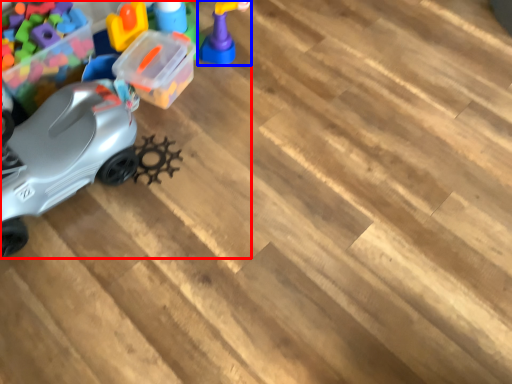
Question: Which object appears closest to the camera in this image, toy (highlighted by a red box) or toy (highlighted by a blue box)?

Choices:
 (A) toy
 (B) toy

Answer: (A)